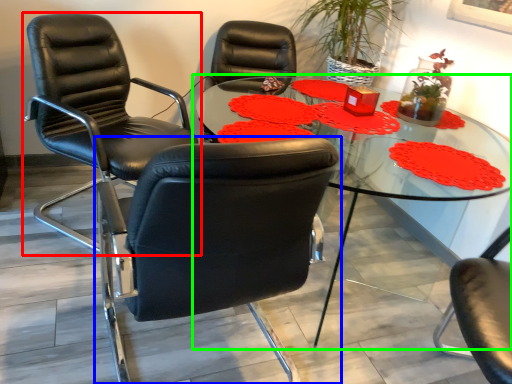
Question: Which is farther away from chair (highlighted by a red box)? chair (highlighted by a blue box) or table (highlighted by a green box)?

Choices:
 (A) chair
 (B) table

Answer: (A)